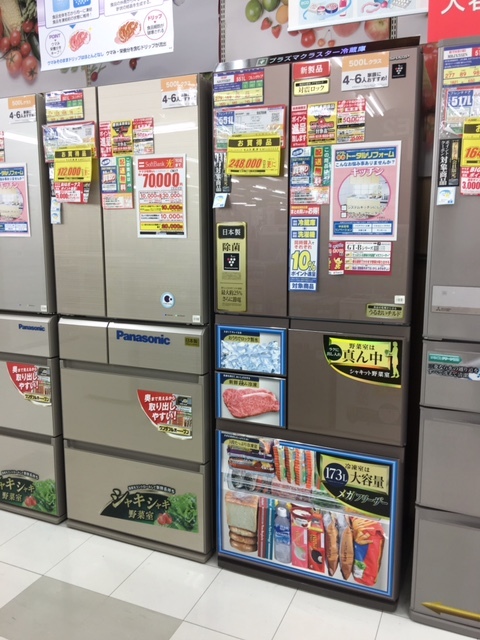
Locate an element on the screen. The width and height of the screenshot is (480, 640). cermaic floor is located at coordinates (123, 628).